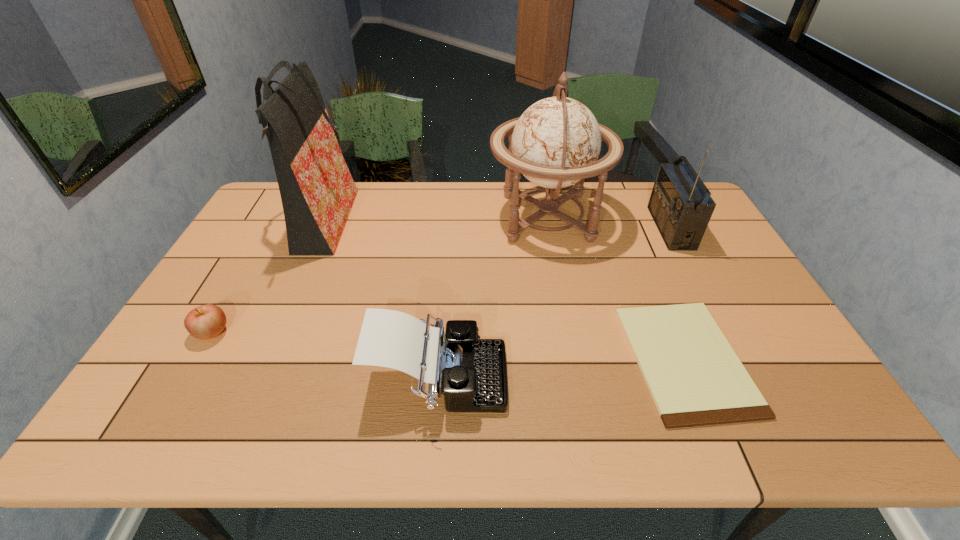
Identify the location of free space between the second shortest object and the globe. (379, 275).

The width and height of the screenshot is (960, 540). I want to click on vacant space in between the radio receiver and the shopping bag, so click(496, 226).

You are a GUI agent. You are given a task and a screenshot of the screen. Output one action in this format:
    pyautogui.click(x=<x>, y=<y>)
    Task: Click on the free spot between the second shortest object and the third shortest object
    This screenshot has width=960, height=540.
    Given the screenshot: What is the action you would take?
    pyautogui.click(x=325, y=356)

Locate an element on the screen. Image resolution: width=960 pixels, height=540 pixels. object that ranks as the third closest to the shortest object is located at coordinates click(471, 372).

Image resolution: width=960 pixels, height=540 pixels. Find the location of `object that is the fifth nearest to the shopping bag`. object that is the fifth nearest to the shopping bag is located at coordinates (680, 204).

Where is `vacant space that satisfies the following two spatial constraints: 1. on the front-facing side of the globe; 2. on the front side of the second shortest object`? The height and width of the screenshot is (540, 960). vacant space that satisfies the following two spatial constraints: 1. on the front-facing side of the globe; 2. on the front side of the second shortest object is located at coordinates (568, 333).

The image size is (960, 540). What are the coordinates of `vacant space that satisfies the following two spatial constraints: 1. on the back side of the clipboard; 2. on the front side of the shopping bag` in the screenshot? It's located at (630, 225).

You are a GUI agent. You are given a task and a screenshot of the screen. Output one action in this format:
    pyautogui.click(x=<x>, y=<y>)
    Task: Click on the free location that satisfies the following two spatial constraints: 1. on the front-facing side of the globe; 2. on the left side of the clipboard
    
    Given the screenshot: What is the action you would take?
    pyautogui.click(x=574, y=359)